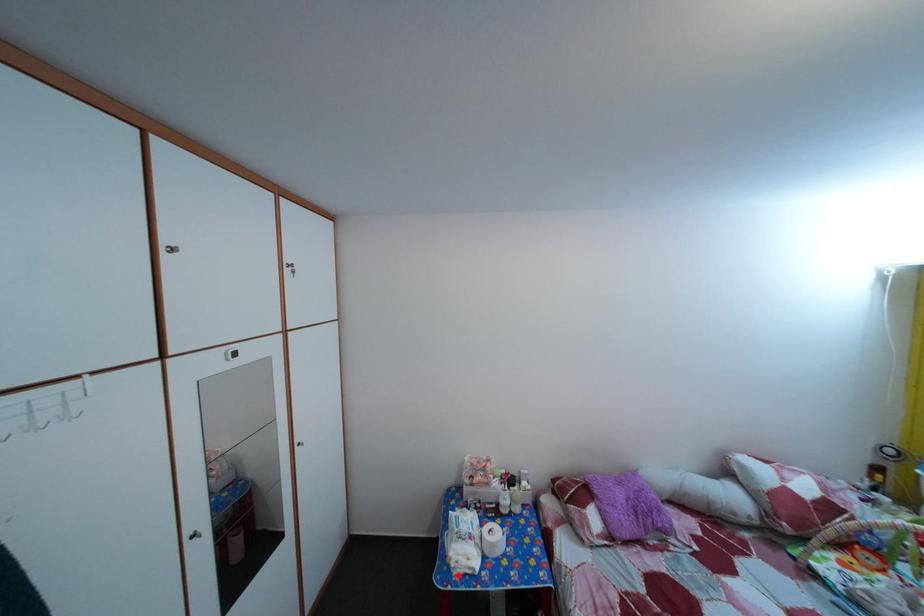
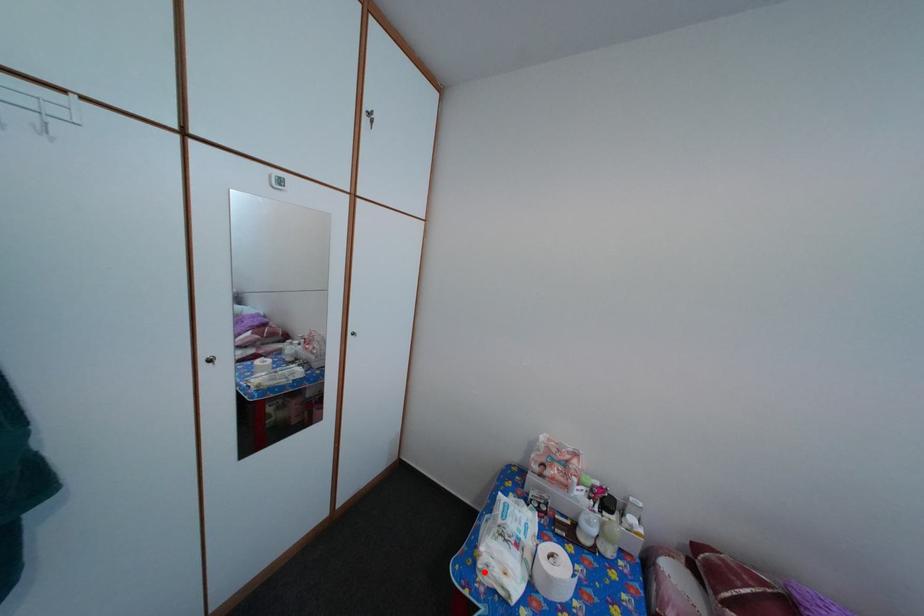
I am providing you with two images of the same scene from different viewpoints. A red point is marked on the first image and another point is marked on the second image. Do the highlighted points in image1 and image2 indicate the same real-world spot?

Yes